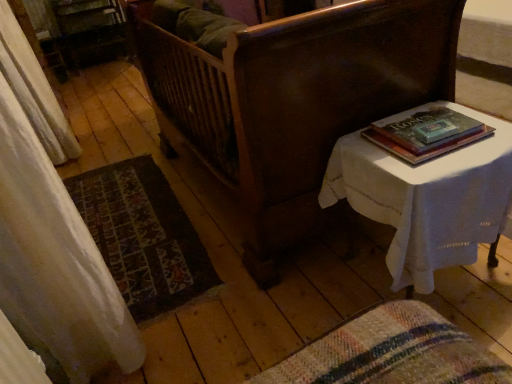
Image resolution: width=512 pixels, height=384 pixels. I want to click on free space in front of hardcover book at upper right, so click(450, 165).